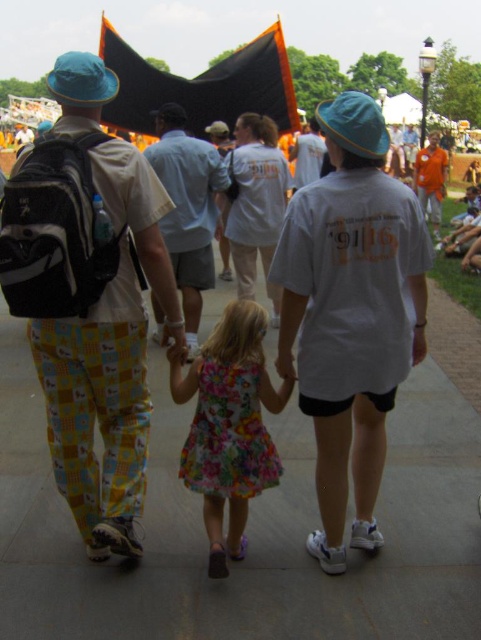
Who is taller, floral fabric dress at center or orange cotton shirt at upper right?

orange cotton shirt at upper right

Who is higher up, floral fabric dress at center or orange cotton shirt at upper right?

Positioned higher is orange cotton shirt at upper right.

Between point (204, 365) and point (427, 163), which one is positioned in front?

Positioned in front is point (204, 365).

You are a GUI agent. You are given a task and a screenshot of the screen. Output one action in this format:
    pyautogui.click(x=<x>, y=<y>)
    Task: Click on the floral fabric dress at center
    The height and width of the screenshot is (640, 481).
    Given the screenshot: What is the action you would take?
    pyautogui.click(x=228, y=426)

Is printed cotton pants at left further to camera compared to white cotton shirt at center?

No, printed cotton pants at left is closer to the viewer.

Is point (134, 353) positioned after point (275, 296)?

No, it is in front of (275, 296).

You are a GUI agent. You are given a task and a screenshot of the screen. Output one action in this format:
    pyautogui.click(x=<x>, y=<y>)
    Task: Click on the printed cotton pants at left
    The width and height of the screenshot is (481, 640).
    Given the screenshot: What is the action you would take?
    pyautogui.click(x=89, y=298)

Does point (52, 333) come closer to viewer compared to point (391, 289)?

No, (52, 333) is behind (391, 289).

Who is positioned more to the right, printed cotton pants at left or gray cotton shirt at center?

gray cotton shirt at center is more to the right.

This screenshot has height=640, width=481. Find the location of `printed cotton pants at left`. printed cotton pants at left is located at coordinates (89, 298).